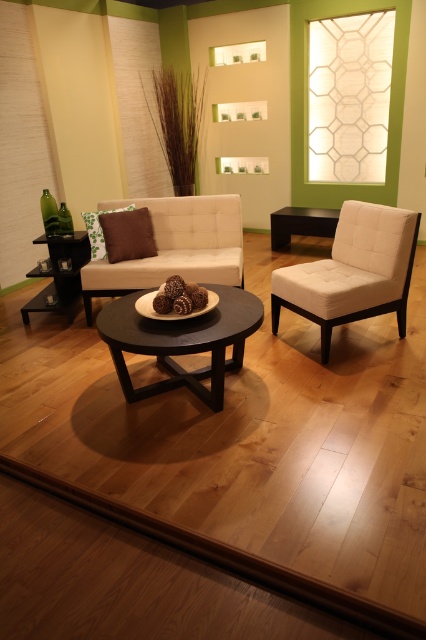
You are sitting on the white fabric chair at center and want to place a book on the brown fabric pillow at left. Can you reach it without moving from your current position?

The white fabric chair at center is in front of the brown fabric pillow at left, so you can reach the brown fabric pillow at left from your current position without moving.

You are standing at the entrance of the living room and want to sit down on the white fabric chair at center. Based on the coordinates provided, can you estimate how far you are from the chair?

The white fabric chair at center is located at coordinates point [353,272], so you are approximately 0.829 meters away from the chair.